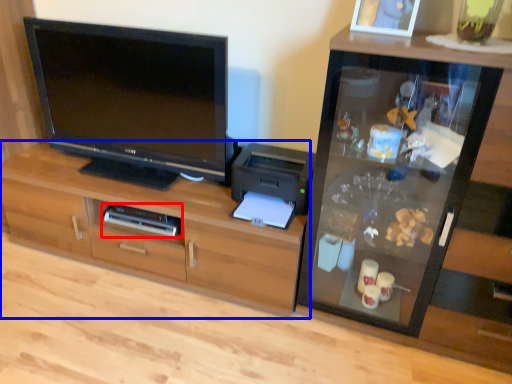
Question: Which point is further to the camera, home appliance (highlighted by a red box) or cabinetry (highlighted by a blue box)?

Choices:
 (A) home appliance
 (B) cabinetry

Answer: (A)